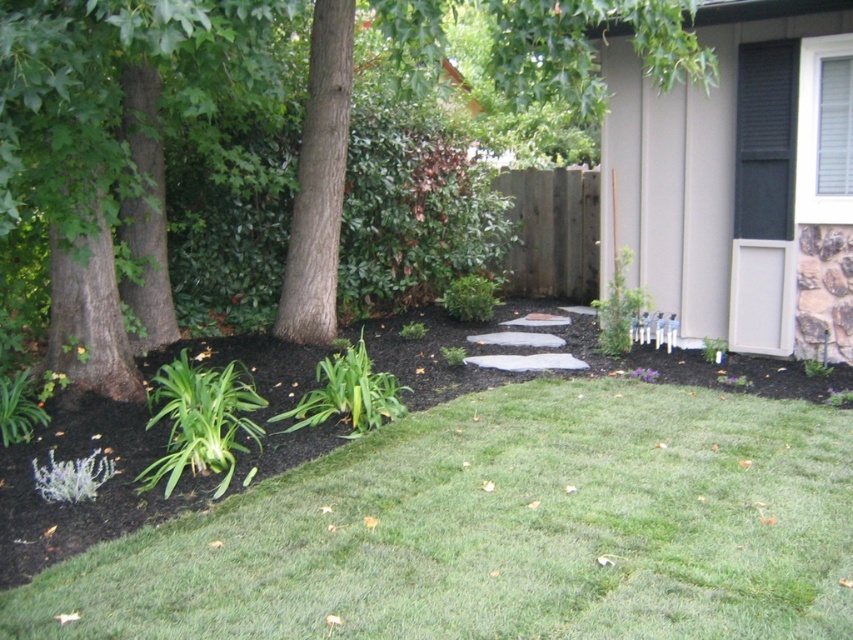
You are a gardener who wants to plant a new flower bed between the green soft grass at lower center and the brown textured tree at center. The flower bed requires a minimum of 3 meters of space. Based on the scene, will there be enough space for the flower bed?

The distance between the green soft grass at lower center and the brown textured tree at center is 2.64 meters, which is less than the required 3 meters. Therefore, there is not enough space for the flower bed.

You are a gardener who needs to place a 4 feet wide decorative stone bench between the brown textured tree at center and the green leafy plant at lower left. Will there be enough space for the bench without moving either object?

The brown textured tree at center and green leafy plant at lower left are 3.85 feet apart. Since the bench is 4 feet wide, there isn not enough space to place it between them without moving either object.